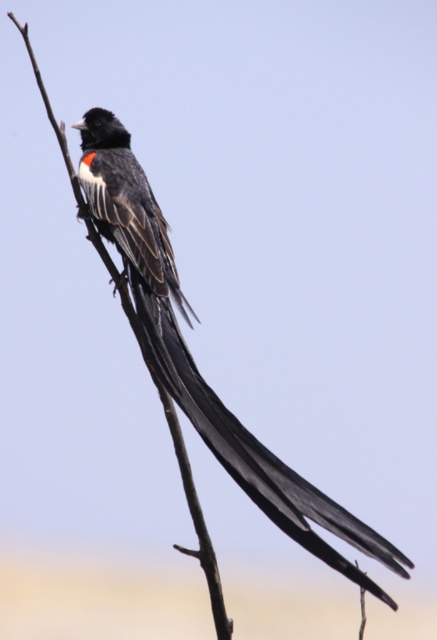
This screenshot has width=437, height=640. What do you see at coordinates (255, 451) in the screenshot?
I see `black feathered tail at center` at bounding box center [255, 451].

Can you confirm if black feathered tail at center is bigger than brown wood tree branch at center?

Yes, black feathered tail at center is bigger than brown wood tree branch at center.

Is point (294, 496) less distant than point (72, 189)?

Yes.

Image resolution: width=437 pixels, height=640 pixels. I want to click on black feathered tail at center, so click(x=255, y=451).